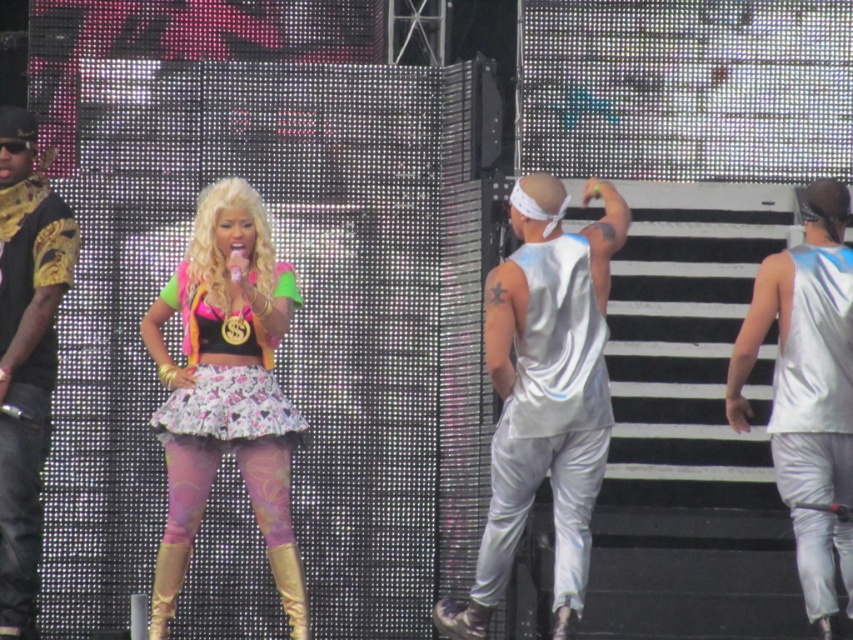
You are a photographer at the stage edge. You want to take a photo of both point markers on the stage. The first point is at position point [56,268] and the second is at point [190,394]. To ensure both are visible, should you adjust your camera angle to look towards the front or the back of the stage?

Since point [56,268] is behind point [190,394], you should adjust your camera angle to look towards the back of the stage to ensure both points are visible.

You are a photographer at the concert and want to capture both the shiny silver tank top at right and the shiny metallic skirt at center in a single frame. Which of the two items will appear smaller in your photo?

The shiny silver tank top at right will appear smaller in the photo because it occupies less space than the shiny metallic skirt at center.